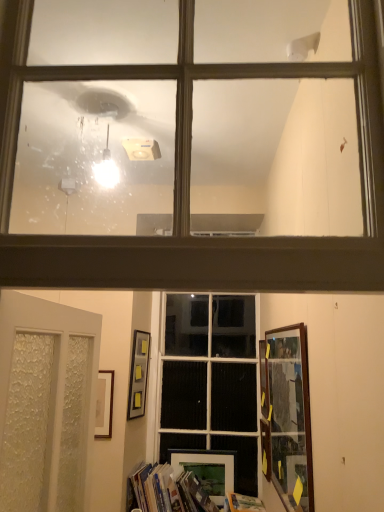
Question: Is matte glass window at upper center, the second window positioned from the bottom, bigger than hardcover book at lower center?

Choices:
 (A) yes
 (B) no

Answer: (A)

Question: Does matte glass window at upper center, the 1th window when ordered from top to bottom, have a smaller size compared to hardcover book at lower center?

Choices:
 (A) yes
 (B) no

Answer: (B)

Question: From a real-world perspective, is matte glass window at upper center, the 1th window when ordered from top to bottom, over hardcover book at lower center?

Choices:
 (A) yes
 (B) no

Answer: (A)

Question: Can you confirm if matte glass window at upper center, the 1th window when ordered from top to bottom, is taller than hardcover book at lower center?

Choices:
 (A) no
 (B) yes

Answer: (B)

Question: From the image's perspective, is matte glass window at upper center, the 2th window positioned from the back, beneath hardcover book at lower center?

Choices:
 (A) no
 (B) yes

Answer: (A)

Question: Considering the relative sizes of matte glass window at upper center, the first window when ordered from front to back, and hardcover book at lower center in the image provided, is matte glass window at upper center, the first window when ordered from front to back, thinner than hardcover book at lower center?

Choices:
 (A) no
 (B) yes

Answer: (B)

Question: Can you confirm if matte black picture frame at upper center, positioned as the 2th picture frame in back-to-front order, is thinner than hardcover book at lower center?

Choices:
 (A) yes
 (B) no

Answer: (A)

Question: From a real-world perspective, is matte black picture frame at upper center, positioned as the 2th picture frame in back-to-front order, on hardcover book at lower center?

Choices:
 (A) yes
 (B) no

Answer: (A)

Question: Considering the relative sizes of matte black picture frame at upper center, the 1th picture frame when ordered from left to right, and hardcover book at lower center in the image provided, is matte black picture frame at upper center, the 1th picture frame when ordered from left to right, taller than hardcover book at lower center?

Choices:
 (A) yes
 (B) no

Answer: (A)

Question: Is matte black picture frame at upper center, positioned as the third picture frame in front-to-back order, directly adjacent to hardcover book at lower center?

Choices:
 (A) no
 (B) yes

Answer: (A)

Question: Is matte black picture frame at upper center, positioned as the fourth picture frame in right-to-left order, positioned behind hardcover book at lower center?

Choices:
 (A) yes
 (B) no

Answer: (A)

Question: Is matte black picture frame at upper center, positioned as the 2th picture frame in back-to-front order, shorter than hardcover book at lower center?

Choices:
 (A) yes
 (B) no

Answer: (B)

Question: Is white frosted glass door at lower left further to camera compared to hardcover book at lower center?

Choices:
 (A) no
 (B) yes

Answer: (A)